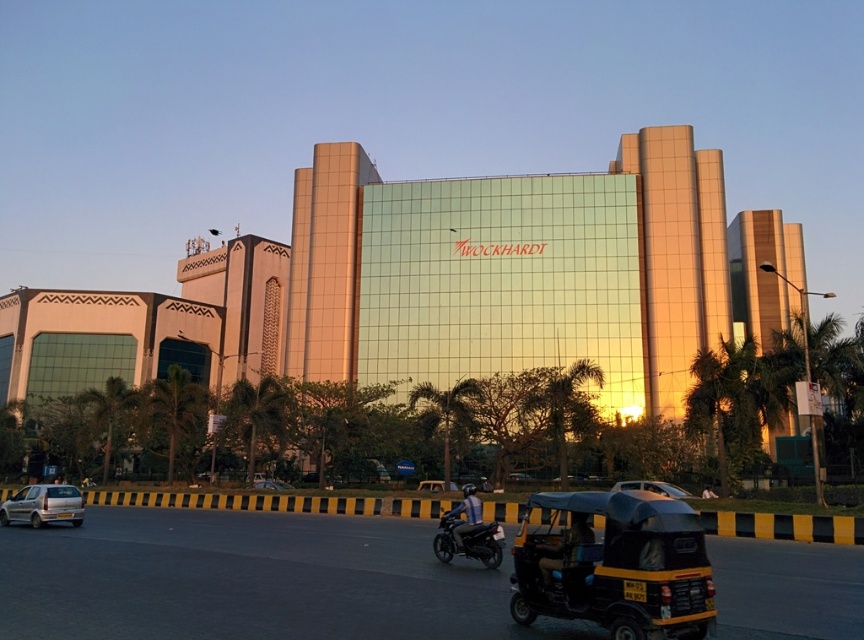
Can you confirm if metallic blue motorcycle at center is positioned below metallic silver car at center?

No.

Is metallic blue motorcycle at center positioned before metallic silver car at center?

Yes, metallic blue motorcycle at center is in front of metallic silver car at center.

Identify the location of metallic blue motorcycle at center. This screenshot has height=640, width=864. (465, 515).

The height and width of the screenshot is (640, 864). In order to click on metallic blue motorcycle at center in this screenshot , I will do `click(465, 515)`.

Between point (570, 560) and point (456, 486), which one is positioned in front?

Positioned in front is point (570, 560).

Who is more distant from viewer, (x=528, y=499) or (x=418, y=490)?

Positioned behind is point (x=418, y=490).

From the picture: Who is more distant from viewer, (633, 506) or (440, 486)?

The point (440, 486) is behind.

Image resolution: width=864 pixels, height=640 pixels. What are the coordinates of `yellow and black auto-rickshaw at lower right` in the screenshot? It's located at (614, 564).

Who is taller, metallic blue car at center or metallic silver car at center?

Standing taller between the two is metallic blue car at center.

Is point (677, 497) positioned after point (456, 486)?

No, (677, 497) is in front of (456, 486).

Is point (626, 483) in front of point (455, 490)?

Yes, point (626, 483) is closer to viewer.

What are the coordinates of `metallic blue car at center` in the screenshot? It's located at pos(652,486).